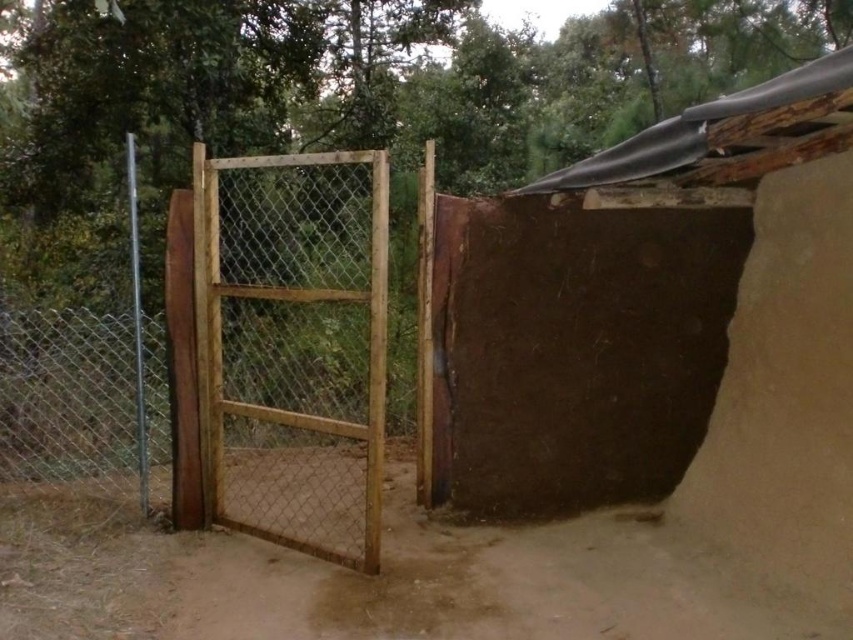
You need to drive a small car through the area. The car is 1.8 meters wide. Looking at the brown sandy dirt track at center and the wooden mesh gate at center, which one do you think the car can pass through?

The brown sandy dirt track at center might be wider than wooden mesh gate at center. Since the car is 1.8 meters wide, it can pass through the brown sandy dirt track at center if it is indeed wider than the car. The wooden mesh gate at center may be too narrow for the car to pass through.

You are a delivery person trying to enter the fenced area. You see the wooden gate at left and the wooden mesh gate at center. Which gate should you approach first to enter the area?

You should approach the wooden gate at left first because the wooden mesh gate at center is behind it, so the wooden gate at left is the entrance point.